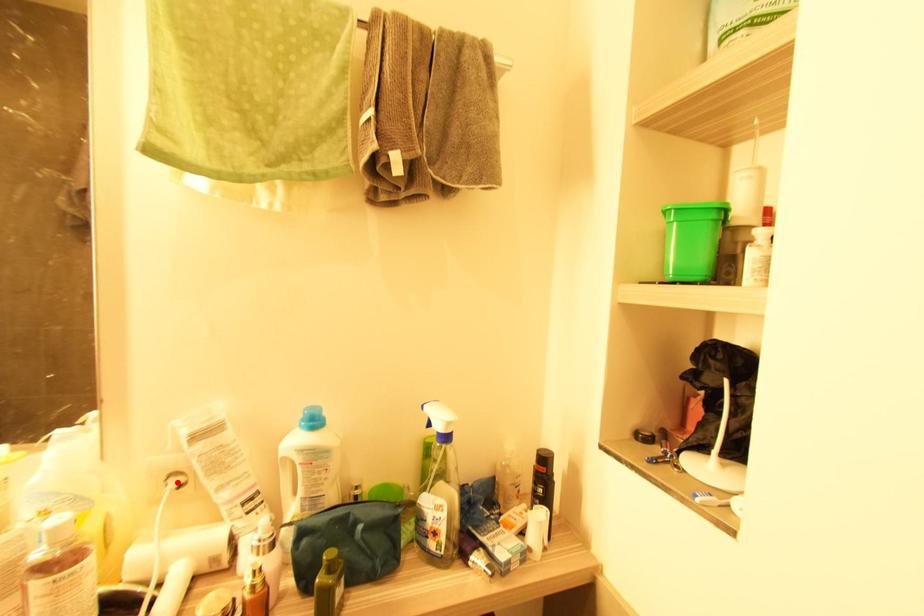
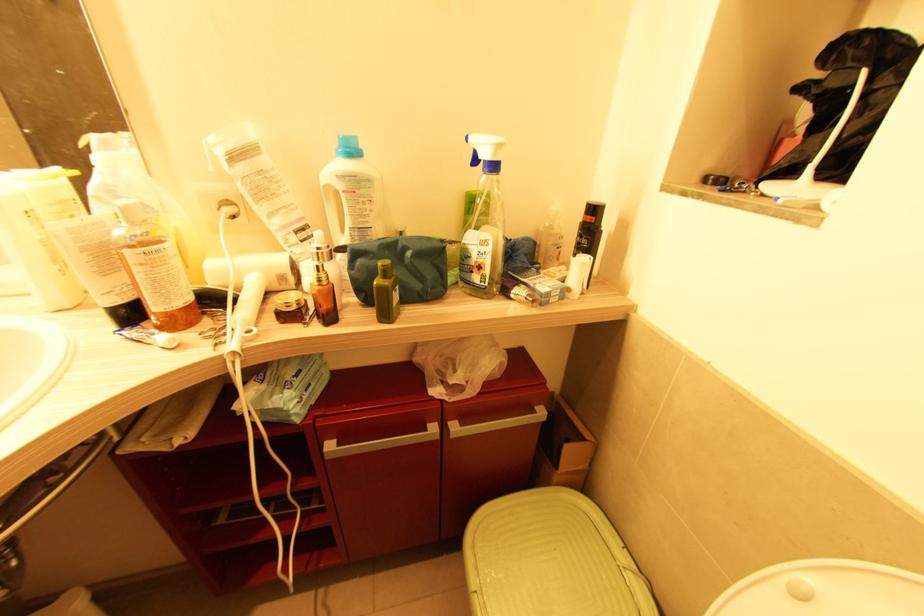
The point at the highlighted location is marked in the first image. Where is the corresponding point in the second image?

(229, 211)